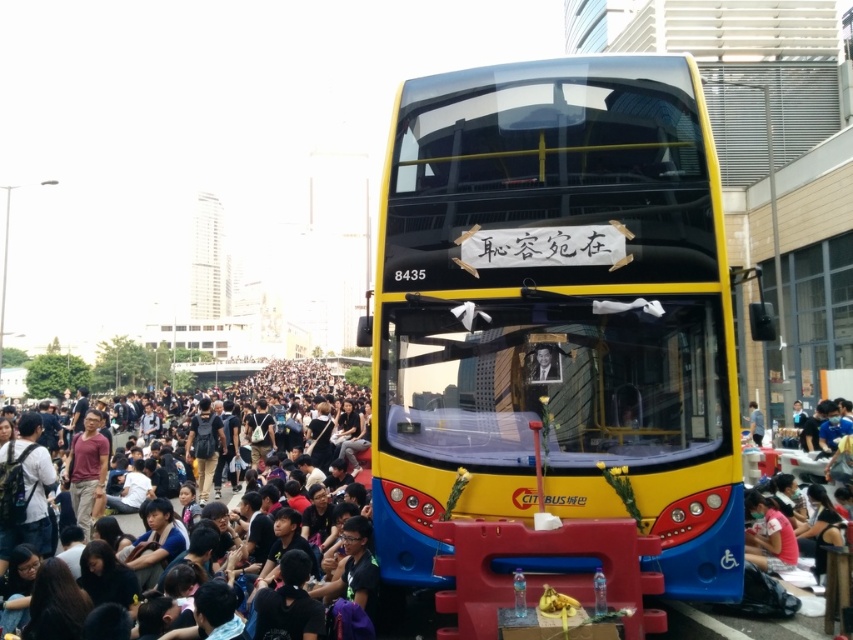
Question: Which point is closer to the camera taking this photo?

Choices:
 (A) (283, 387)
 (B) (610, 506)

Answer: (B)

Question: Which object appears closest to the camera in this image?

Choices:
 (A) black fabric crowd at lower center
 (B) yellow matte bus at center

Answer: (B)

Question: Does yellow matte bus at center appear under black fabric crowd at lower center?

Choices:
 (A) yes
 (B) no

Answer: (B)

Question: Does yellow matte bus at center have a greater width compared to black fabric crowd at lower center?

Choices:
 (A) yes
 (B) no

Answer: (B)

Question: Can you confirm if yellow matte bus at center is positioned to the left of black fabric crowd at lower center?

Choices:
 (A) yes
 (B) no

Answer: (B)